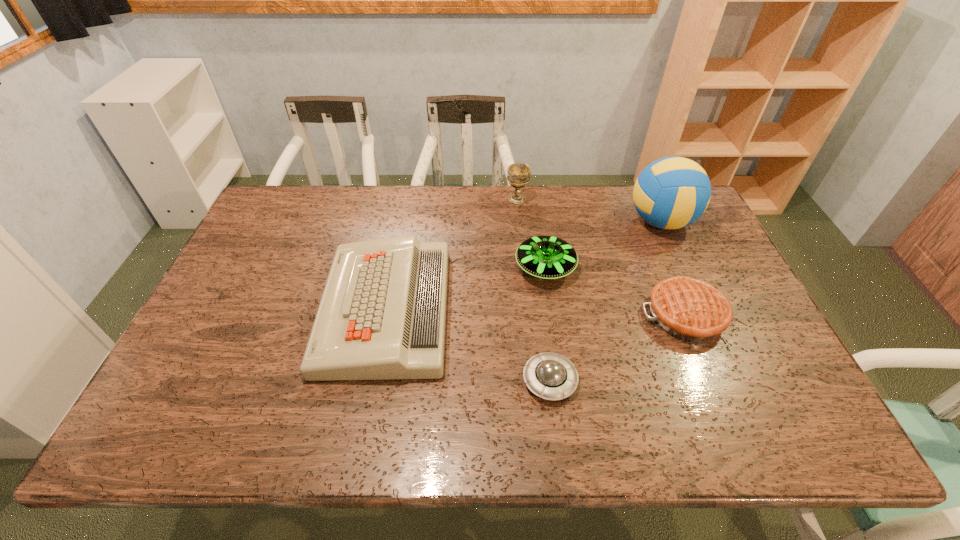
Identify the location of object that is the second closest to the shorter saucer. Image resolution: width=960 pixels, height=540 pixels. (689, 309).

Select which object appears as the closest to the farther saucer. Please provide its 2D coordinates. Your answer should be formatted as a tuple, i.e. [(x, y)], where the tuple contains the x and y coordinates of a point satisfying the conditions above.

[(689, 309)]

This screenshot has width=960, height=540. I want to click on vacant area that satisfies the following two spatial constraints: 1. on the front side of the pie; 2. on the right side of the computer keyboard, so click(x=384, y=315).

You are a GUI agent. You are given a task and a screenshot of the screen. Output one action in this format:
    pyautogui.click(x=<x>, y=<y>)
    Task: Click on the free location that satisfies the following two spatial constraints: 1. on the front side of the pie; 2. on the left side of the computer keyboard
    This screenshot has height=540, width=960.
    Given the screenshot: What is the action you would take?
    pyautogui.click(x=384, y=315)

Locate an element on the screen. The image size is (960, 540). vacant space that satisfies the following two spatial constraints: 1. on the front side of the leftmost object; 2. on the right side of the pie is located at coordinates (384, 315).

Locate an element on the screen. This screenshot has height=540, width=960. free space that satisfies the following two spatial constraints: 1. on the front side of the shorter saucer; 2. on the right side of the computer keyboard is located at coordinates (372, 380).

Find the location of a particular element. free location that satisfies the following two spatial constraints: 1. on the back side of the shortest object; 2. on the left side of the tallest object is located at coordinates pos(530,221).